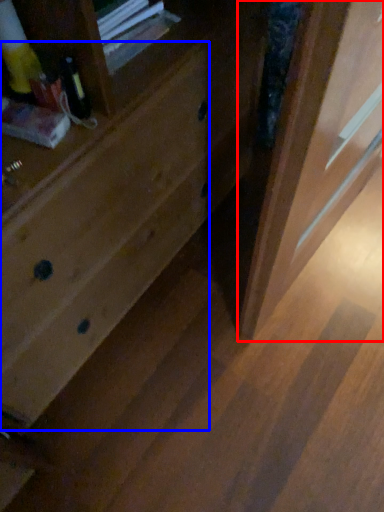
Question: Which object appears farthest to the camera in this image, screen door (highlighted by a red box) or drawer (highlighted by a blue box)?

Choices:
 (A) screen door
 (B) drawer

Answer: (A)